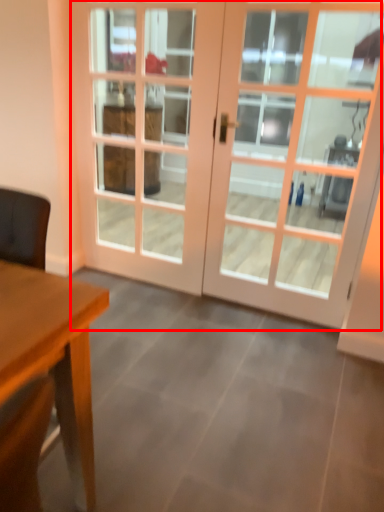
Question: Where is door (annotated by the red box) located in relation to screen door in the image?

Choices:
 (A) left
 (B) right

Answer: (B)